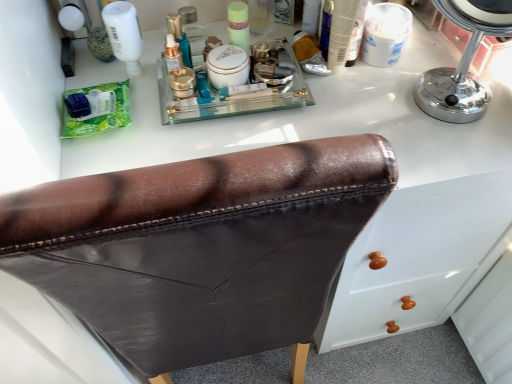
Question: Looking at their shapes, would you say green matte packet at left is wider or thinner than matte green jar at center?

Choices:
 (A) wide
 (B) thin

Answer: (A)

Question: Considering the positions of green matte packet at left and matte green jar at center in the image, is green matte packet at left taller or shorter than matte green jar at center?

Choices:
 (A) short
 (B) tall

Answer: (A)

Question: Estimate the real-world distances between objects in this image. Which object is closer to the green matte packet at left?

Choices:
 (A) matte green jar at center
 (B) chrome/metallic mirror at upper right
 (C) brown leather chair at center

Answer: (A)

Question: Which is nearer to the green matte packet at left?

Choices:
 (A) brown leather chair at center
 (B) matte green jar at center
 (C) chrome/metallic mirror at upper right

Answer: (B)